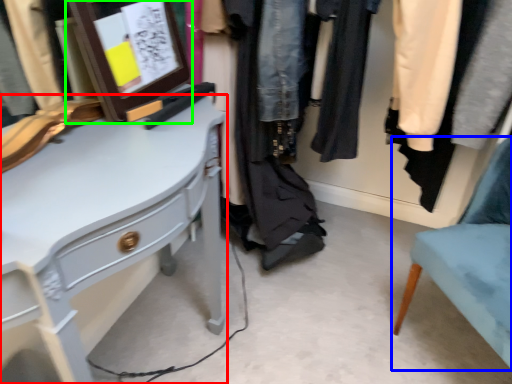
Question: Which is farther away from desk (highlighted by a red box)? chair (highlighted by a blue box) or picture frame (highlighted by a green box)?

Choices:
 (A) chair
 (B) picture frame

Answer: (A)